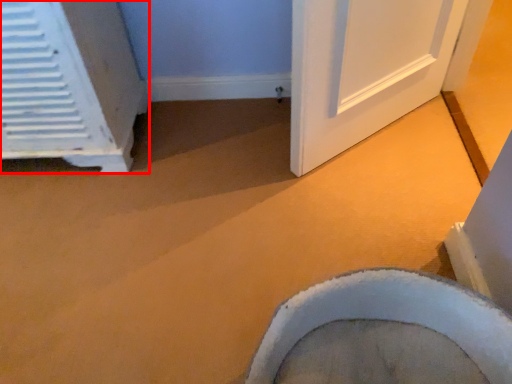
Question: Considering the relative positions of air conditioning (annotated by the red box) and toilet in the image provided, where is air conditioning (annotated by the red box) located with respect to the staircase?

Choices:
 (A) right
 (B) left

Answer: (B)